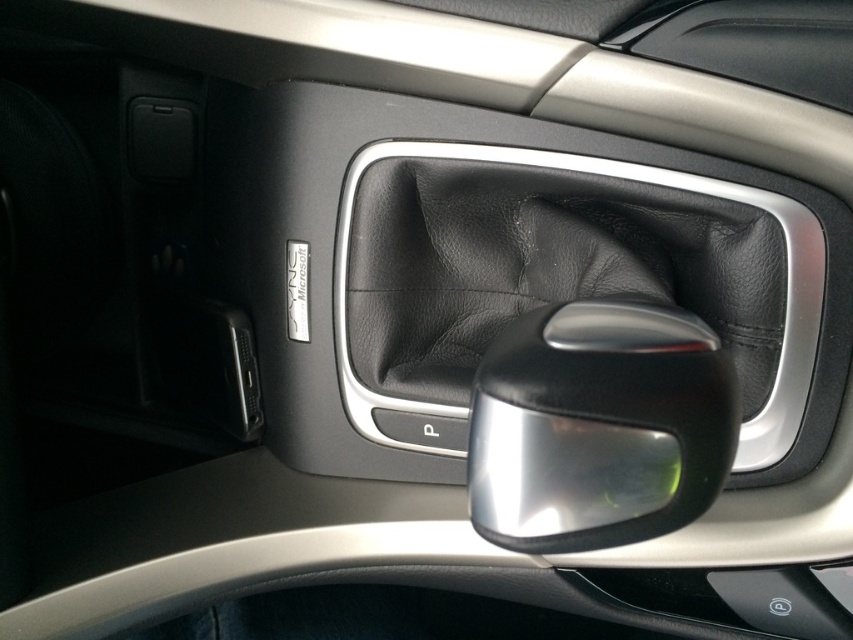
Can you confirm if black leather at center is shorter than satin black door handle at center?

No, black leather at center is not shorter than satin black door handle at center.

Who is positioned more to the right, black leather at center or satin black door handle at center?

From the viewer's perspective, black leather at center appears more on the right side.

Is point (791, 444) more distant than point (512, 528)?

Yes, it is behind point (512, 528).

What are the coordinates of `black leather at center` in the screenshot? It's located at (546, 272).